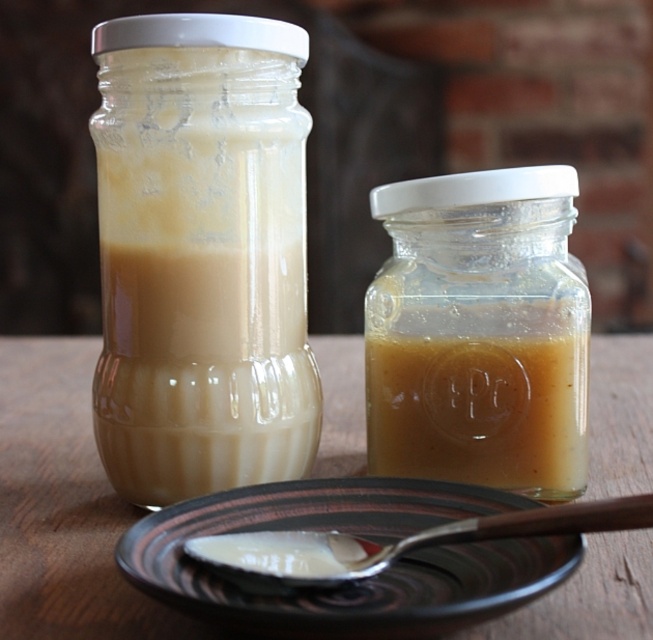
Question: Is translucent glass jar at left bigger than matte ceramic plate at lower center?

Choices:
 (A) no
 (B) yes

Answer: (B)

Question: Does translucent glass jar at left have a lesser width compared to translucent glass jar at center?

Choices:
 (A) no
 (B) yes

Answer: (B)

Question: Can you confirm if translucent glass jar at center is thinner than matte ceramic plate at lower center?

Choices:
 (A) yes
 (B) no

Answer: (A)

Question: Based on their relative distances, which object is nearer to the wooden table at center?

Choices:
 (A) translucent glass jar at left
 (B) translucent glass jar at center
 (C) silver metallic spoon at lower center
 (D) matte ceramic plate at lower center

Answer: (B)

Question: Which of the following is the farthest from the observer?

Choices:
 (A) translucent glass jar at left
 (B) translucent glass jar at center
 (C) silver metallic spoon at lower center

Answer: (B)

Question: Which point is farther to the camera?

Choices:
 (A) translucent glass jar at center
 (B) silver metallic spoon at lower center

Answer: (A)